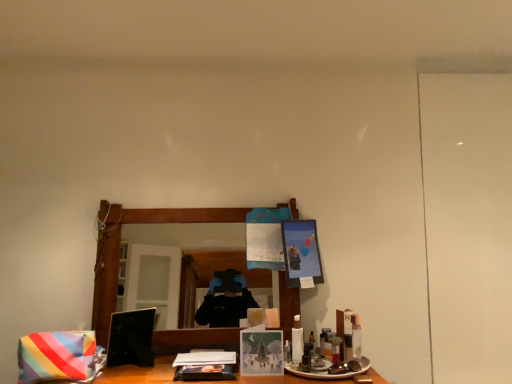
What is the approximate height of wooden mirror at center?

29.65 inches.

The height and width of the screenshot is (384, 512). What do you see at coordinates (301, 253) in the screenshot? I see `matte black picture frame at upper center, acting as the 1th picture frame starting from the top` at bounding box center [301, 253].

Describe the element at coordinates (261, 352) in the screenshot. This screenshot has height=384, width=512. I see `matte paper card at center, positioned as the 1th picture frame in bottom-to-top order` at that location.

What is the approximate height of white plastic bottle at center, the 2th toiletry positioned from the right?

It is 7.16 inches.

Image resolution: width=512 pixels, height=384 pixels. I want to click on wooden mirror at center, so click(119, 248).

Which object is closer to the camera taking this photo, matte paper card at center, which ranks as the 2th picture frame in right-to-left order, or matte black picture frame at upper center, which is counted as the 2th picture frame, starting from the bottom?

matte paper card at center, which ranks as the 2th picture frame in right-to-left order.

Between matte paper card at center, which appears as the second picture frame when viewed from the back, and matte black picture frame at upper center, the first picture frame positioned from the right, which one appears on the left side from the viewer's perspective?

From the viewer's perspective, matte paper card at center, which appears as the second picture frame when viewed from the back, appears more on the left side.

Who is bigger, matte paper card at center, arranged as the 1th picture frame when viewed from the front, or matte black picture frame at upper center, positioned as the second picture frame in left-to-right order?

With larger size is matte black picture frame at upper center, positioned as the second picture frame in left-to-right order.

Is rainbow striped fabric at lower left shorter than wooden mirror at center?

Yes, rainbow striped fabric at lower left is shorter than wooden mirror at center.

Is wooden mirror at center completely or partially inside rainbow striped fabric at lower left?

No, rainbow striped fabric at lower left does not contain wooden mirror at center.

Looking at their sizes, would you say rainbow striped fabric at lower left is wider or thinner than wooden mirror at center?

rainbow striped fabric at lower left is wider than wooden mirror at center.

Between point (89, 362) and point (290, 308), which one is positioned behind?

The point (290, 308) is more distant.

How far apart are rainbow striped fabric at lower left and white plastic bottle at center, positioned as the first toiletry in left-to-right order?

rainbow striped fabric at lower left is 33.11 inches from white plastic bottle at center, positioned as the first toiletry in left-to-right order.

Is rainbow striped fabric at lower left with white plastic bottle at center, the 2th toiletry positioned from the right?

rainbow striped fabric at lower left and white plastic bottle at center, the 2th toiletry positioned from the right, are not in contact.

Is rainbow striped fabric at lower left facing towards white plastic bottle at center, positioned as the first toiletry in left-to-right order?

No.

Based on the photo, does rainbow striped fabric at lower left lie in front of white plastic bottle at center, the 2th toiletry positioned from the right?

Yes, rainbow striped fabric at lower left is closer to the camera.

Is white plastic bottle at center, positioned as the first toiletry in left-to-right order, further to camera compared to wooden mirror at center?

No, white plastic bottle at center, positioned as the first toiletry in left-to-right order, is in front of wooden mirror at center.

From the picture: Does white plastic bottle at center, the 2th toiletry positioned from the right, have a larger size compared to wooden mirror at center?

No, white plastic bottle at center, the 2th toiletry positioned from the right, is not bigger than wooden mirror at center.

This screenshot has width=512, height=384. I want to click on mirror on the left of white plastic bottle at center, the 2th toiletry positioned from the right, so click(x=119, y=248).

This screenshot has width=512, height=384. In order to click on material below the matte black picture frame at upper center, the second picture frame positioned from the front (from the image's perspective) in this screenshot , I will do `click(57, 356)`.

Looking at this image, what's the angular difference between matte black picture frame at upper center, which is counted as the 2th picture frame, starting from the bottom, and rainbow striped fabric at lower left's facing directions?

The angular difference between matte black picture frame at upper center, which is counted as the 2th picture frame, starting from the bottom, and rainbow striped fabric at lower left is 0.948 degrees.

From the picture: Is matte black picture frame at upper center, the second picture frame positioned from the front, far away from rainbow striped fabric at lower left?

No, matte black picture frame at upper center, the second picture frame positioned from the front, is in close proximity to rainbow striped fabric at lower left.

Does point (303, 239) appear closer or farther from the camera than point (296, 316)?

Point (303, 239).

From the picture: What's the angular difference between matte black picture frame at upper center, which is the 1th picture frame in back-to-front order, and white plastic bottle at center, positioned as the first toiletry in left-to-right order,'s facing directions?

3.66 degrees.

Is matte black picture frame at upper center, the first picture frame positioned from the right, facing away from white plastic bottle at center, positioned as the first toiletry in left-to-right order?

No, matte black picture frame at upper center, the first picture frame positioned from the right,'s orientation is not away from white plastic bottle at center, positioned as the first toiletry in left-to-right order.

Does matte black picture frame at upper center, the second picture frame positioned from the front, have a greater height compared to white plastic bottle at center, the 2th toiletry positioned from the right?

Yes, matte black picture frame at upper center, the second picture frame positioned from the front, is taller than white plastic bottle at center, the 2th toiletry positioned from the right.

Is matte paper card at center, which is counted as the first picture frame, starting from the left, bigger or smaller than wooden mirror at center?

In the image, matte paper card at center, which is counted as the first picture frame, starting from the left, appears to be smaller than wooden mirror at center.

Is point (270, 347) positioned after point (103, 310)?

No, (270, 347) is closer to viewer.

Would you consider matte paper card at center, arranged as the second picture frame when viewed from the top, to be distant from wooden mirror at center?

Actually, matte paper card at center, arranged as the second picture frame when viewed from the top, and wooden mirror at center are a little close together.

The height and width of the screenshot is (384, 512). Identify the location of picture frame above the matte paper card at center, positioned as the 1th picture frame in bottom-to-top order (from the image's perspective). (301, 253).

Locate an element on the screen. This screenshot has width=512, height=384. material below the wooden mirror at center (from a real-world perspective) is located at coordinates (57, 356).

Which object lies further to the anchor point clear plastic bottle at lower right, marked as the 1th toiletry in a right-to-left arrangement, white plastic bottle at center, positioned as the first toiletry in left-to-right order, or matte black picture frame at upper center, acting as the 1th picture frame starting from the top?

matte black picture frame at upper center, acting as the 1th picture frame starting from the top, lies further to clear plastic bottle at lower right, marked as the 1th toiletry in a right-to-left arrangement, than the other object.

Consider the image. Estimate the real-world distances between objects in this image. Which object is further from matte black picture frame at upper center, which is counted as the 2th picture frame, starting from the bottom, white plastic bottle at center, positioned as the first toiletry in left-to-right order, or clear plastic bottle at lower right, marked as the 1th toiletry in a right-to-left arrangement?

The object further to matte black picture frame at upper center, which is counted as the 2th picture frame, starting from the bottom, is clear plastic bottle at lower right, marked as the 1th toiletry in a right-to-left arrangement.

From the image, which object appears to be nearer to matte black picture frame at upper center, the second picture frame positioned from the front, rainbow striped fabric at lower left or clear plastic bottle at lower right, marked as the 1th toiletry in a right-to-left arrangement?

Among the two, clear plastic bottle at lower right, marked as the 1th toiletry in a right-to-left arrangement, is located nearer to matte black picture frame at upper center, the second picture frame positioned from the front.

Considering their positions, is clear plastic bottle at lower right, which is the second toiletry in left-to-right order, positioned closer to wooden mirror at center than white plastic bottle at center, positioned as the first toiletry in left-to-right order?

The object closer to wooden mirror at center is white plastic bottle at center, positioned as the first toiletry in left-to-right order.

From the image, which object appears to be nearer to matte black picture frame at upper center, which is counted as the 2th picture frame, starting from the bottom, matte paper card at center, which appears as the second picture frame when viewed from the back, or rainbow striped fabric at lower left?

matte paper card at center, which appears as the second picture frame when viewed from the back.

Which object lies further to the anchor point matte paper card at center, arranged as the second picture frame when viewed from the top, wooden mirror at center or white plastic bottle at center, positioned as the first toiletry in left-to-right order?

Based on the image, wooden mirror at center appears to be further to matte paper card at center, arranged as the second picture frame when viewed from the top.

Looking at the image, which one is located further to white plastic bottle at center, positioned as the first toiletry in left-to-right order, matte black picture frame at upper center, which is the 1th picture frame in back-to-front order, or clear plastic bottle at lower right, marked as the 1th toiletry in a right-to-left arrangement?

matte black picture frame at upper center, which is the 1th picture frame in back-to-front order, lies further to white plastic bottle at center, positioned as the first toiletry in left-to-right order, than the other object.

Estimate the real-world distances between objects in this image. Which object is further from clear plastic bottle at lower right, which is the second toiletry in left-to-right order, rainbow striped fabric at lower left or wooden mirror at center?

rainbow striped fabric at lower left lies further to clear plastic bottle at lower right, which is the second toiletry in left-to-right order, than the other object.

Image resolution: width=512 pixels, height=384 pixels. What are the coordinates of `picture frame situated between rainbow striped fabric at lower left and white plastic bottle at center, positioned as the first toiletry in left-to-right order, from left to right` in the screenshot? It's located at click(x=261, y=352).

This screenshot has height=384, width=512. In order to click on mirror between rainbow striped fabric at lower left and white plastic bottle at center, positioned as the first toiletry in left-to-right order, from left to right in this screenshot , I will do `click(119, 248)`.

Identify the location of mirror between rainbow striped fabric at lower left and matte paper card at center, which ranks as the 2th picture frame in right-to-left order, from left to right. (119, 248).

Identify the location of toiletry between rainbow striped fabric at lower left and clear plastic bottle at lower right, which is the second toiletry in left-to-right order. The height and width of the screenshot is (384, 512). (297, 340).